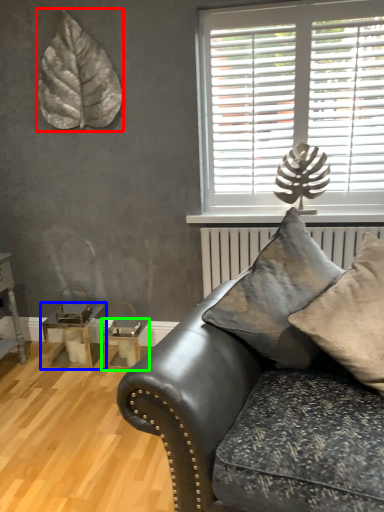
Question: Considering the real-world distances, which object is closest to leaf (highlighted by a red box)? table (highlighted by a blue box) or table (highlighted by a green box).

Choices:
 (A) table
 (B) table

Answer: (A)